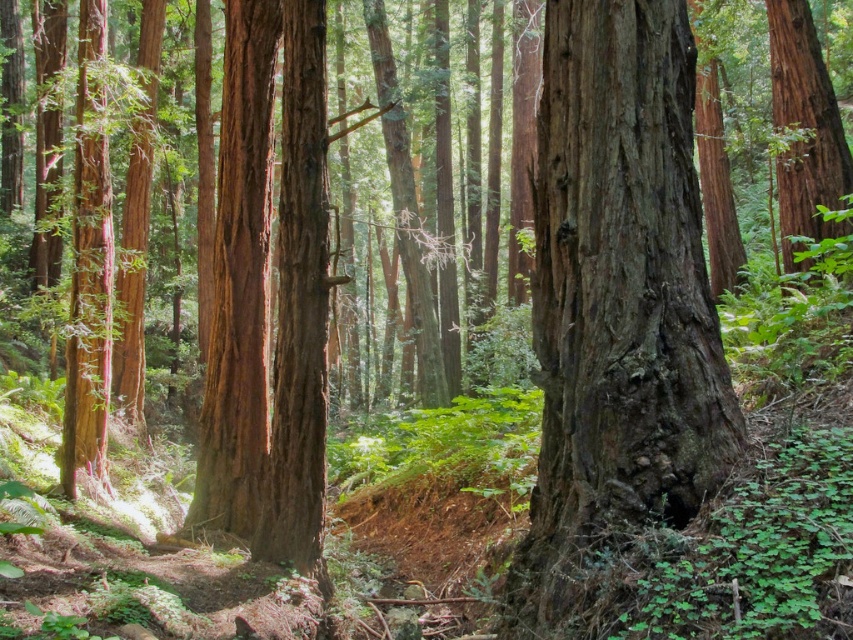
Question: Does rough bark tree at center appear on the right side of smooth brown tree trunk at right?

Choices:
 (A) no
 (B) yes

Answer: (A)

Question: Can you confirm if rough bark tree at center is bigger than smooth brown tree trunk at right?

Choices:
 (A) yes
 (B) no

Answer: (A)

Question: Among these points, which one is farthest from the camera?

Choices:
 (A) (561, 364)
 (B) (805, 234)

Answer: (B)

Question: Which object is closer to the camera taking this photo?

Choices:
 (A) rough bark tree at center
 (B) smooth brown tree trunk at right

Answer: (A)

Question: Does rough bark tree at center appear on the left side of smooth brown tree trunk at right?

Choices:
 (A) no
 (B) yes

Answer: (B)